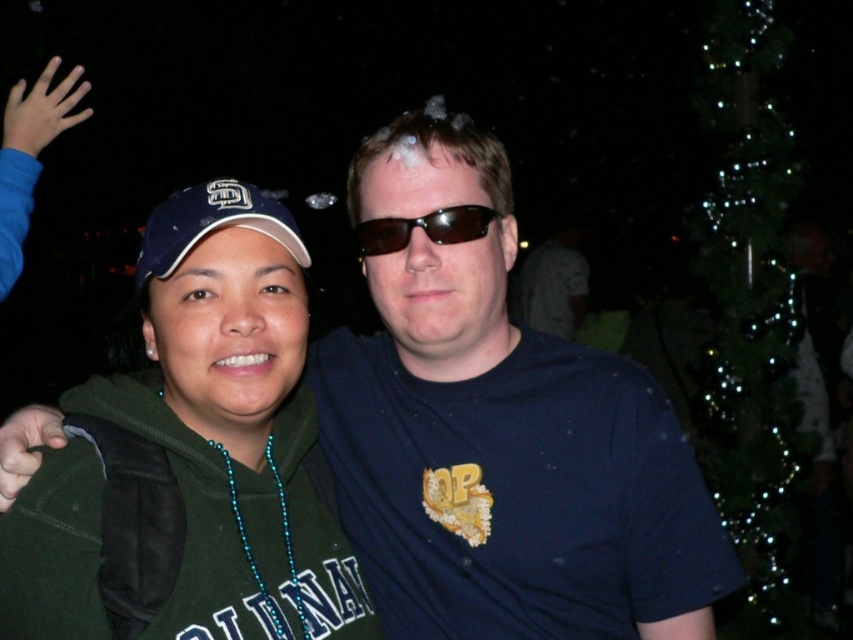
Is dark blue t-shirt at center to the left of green matte hoodie at center from the viewer's perspective?

In fact, dark blue t-shirt at center is to the right of green matte hoodie at center.

Can you confirm if dark blue t-shirt at center is positioned to the right of green matte hoodie at center?

Correct, you'll find dark blue t-shirt at center to the right of green matte hoodie at center.

Locate an element on the screen. This screenshot has height=640, width=853. dark blue t-shirt at center is located at coordinates (500, 435).

Find the location of a particular element. dark blue t-shirt at center is located at coordinates (500, 435).

Is green matte hoodie at center below blue matte hand at upper left?

Correct, green matte hoodie at center is located below blue matte hand at upper left.

The image size is (853, 640). I want to click on green matte hoodie at center, so click(231, 424).

Where is `green matte hoodie at center`? The height and width of the screenshot is (640, 853). green matte hoodie at center is located at coordinates (231, 424).

Who is more distant from viewer, (53, 115) or (19, 451)?

Positioned behind is point (53, 115).

Is blue matte hand at upper left thinner than dark skin hand at lower left?

Incorrect, blue matte hand at upper left's width is not less than dark skin hand at lower left's.

Who is more distant from viewer, (20, 113) or (13, 417)?

Point (20, 113)

Locate an element on the screen. Image resolution: width=853 pixels, height=640 pixels. blue matte hand at upper left is located at coordinates (42, 109).